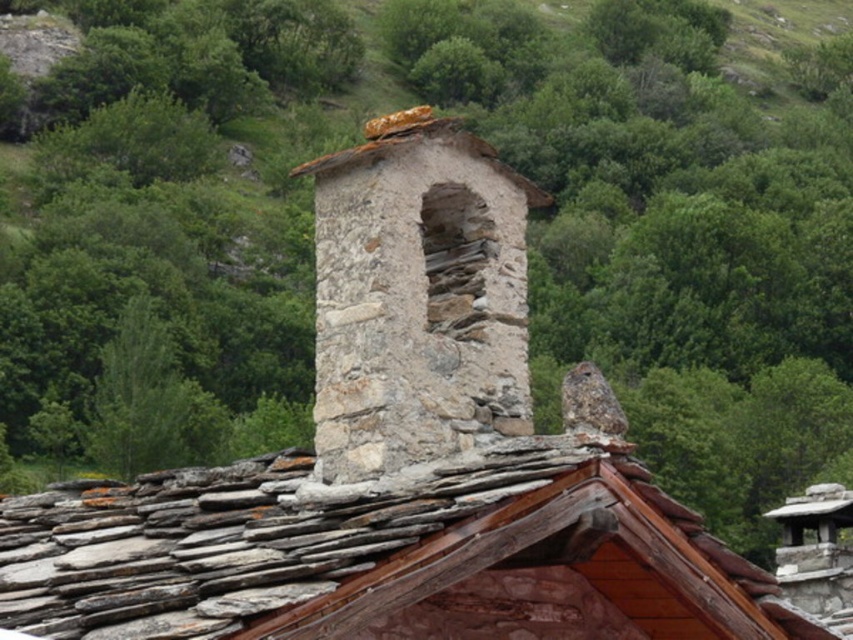
You are standing on the roof and see the gray slate tiles at center and the natural stone chimney at center. Which object is positioned to the left?

The gray slate tiles at center is positioned to the left of the natural stone chimney at center.

You are a contractor assessing the roof of a historic building. You notice the gray slate tiles at center and the natural stone chimney at center. Which object has a larger size in the image?

The gray slate tiles at center has a larger size compared to the natural stone chimney at center.